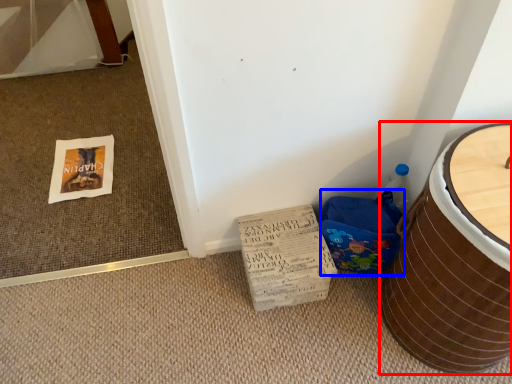
Question: Which point is closer to the camera, furniture (highlighted by a red box) or potty (highlighted by a blue box)?

Choices:
 (A) furniture
 (B) potty

Answer: (A)